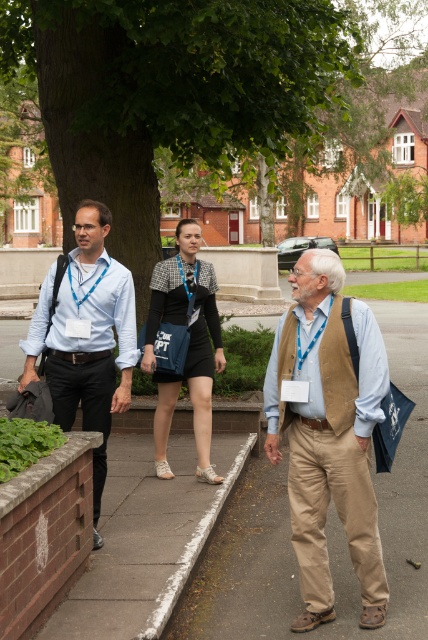
Looking at this image, does brown asphalt at center have a lesser width compared to khaki pants at center?

No.

Can you confirm if brown asphalt at center is positioned to the left of khaki pants at center?

In fact, brown asphalt at center is to the right of khaki pants at center.

Which is behind, point (270, 486) or point (357, 305)?

Positioned behind is point (270, 486).

Locate an element on the screen. This screenshot has height=640, width=428. brown asphalt at center is located at coordinates (326, 531).

Which is more to the right, khaki pants at center or matte blue shirt at left?

Positioned to the right is khaki pants at center.

In the scene shown: Can you confirm if khaki pants at center is positioned below matte blue shirt at left?

Yes.

Is point (351, 413) positioned behind point (92, 486)?

That is False.

Where is `khaki pants at center`? khaki pants at center is located at coordinates (329, 435).

Between green leafy tree at center and black textured jacket at center, which one is positioned lower?

black textured jacket at center is lower down.

Is point (294, 74) closer to viewer compared to point (187, 288)?

No, (294, 74) is further to viewer.

The image size is (428, 640). What are the coordinates of `green leafy tree at center` in the screenshot? It's located at (169, 93).